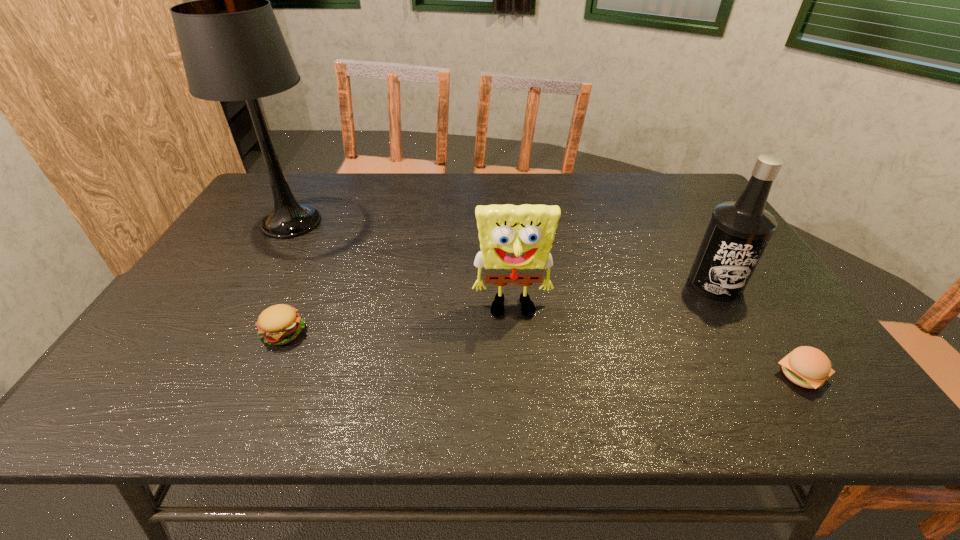
I want to click on blank area at the far edge, so click(411, 206).

At what (x,y) coordinates should I click in order to perform the action: click on free region at the near edge of the desktop. Please return your answer as a coordinate pair (x, y). The height and width of the screenshot is (540, 960). Looking at the image, I should click on (560, 408).

Identify the location of free region at the left edge. (264, 253).

The image size is (960, 540). In order to click on vacant point at the right edge in this screenshot , I will do `click(707, 226)`.

In the image, there is a desktop. What are the coordinates of `vacant space at the far right corner` in the screenshot? It's located at (669, 177).

In the image, there is a desktop. Where is `vacant area at the near right corner`? The height and width of the screenshot is (540, 960). vacant area at the near right corner is located at coordinates (848, 394).

Where is `unoccupied area between the farthest object and the left hamburger`? unoccupied area between the farthest object and the left hamburger is located at coordinates (287, 277).

You are a GUI agent. You are given a task and a screenshot of the screen. Output one action in this format:
    pyautogui.click(x=<x>, y=<y>)
    Task: Click on the vacant area that lies between the farther hamburger and the nearer hamburger
    The width and height of the screenshot is (960, 540).
    Given the screenshot: What is the action you would take?
    pyautogui.click(x=542, y=354)

What are the coordinates of `blank region between the farther hamburger and the tallest object` in the screenshot? It's located at (287, 277).

Where is `vacant space that is in between the third object from left to right and the left hamburger`? The height and width of the screenshot is (540, 960). vacant space that is in between the third object from left to right and the left hamburger is located at coordinates (398, 321).